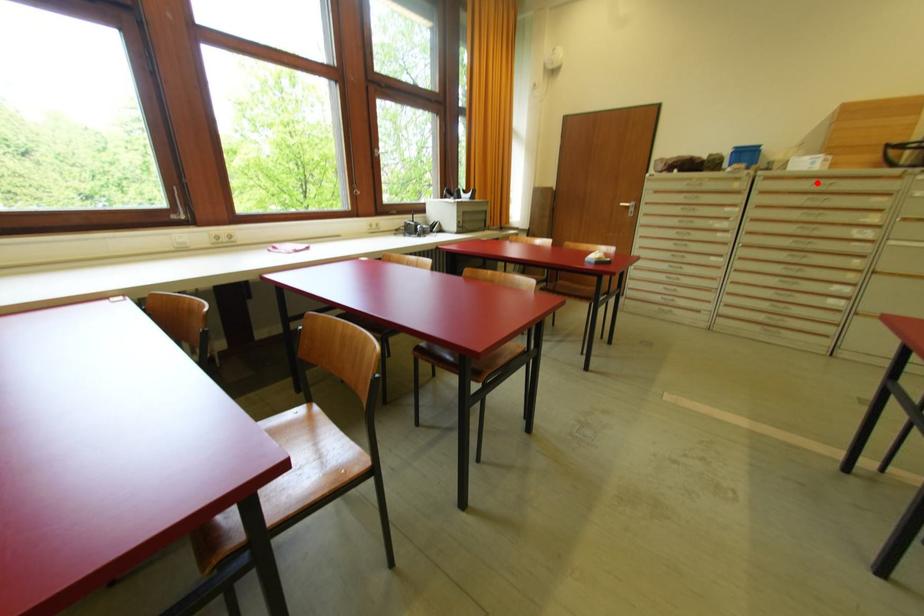
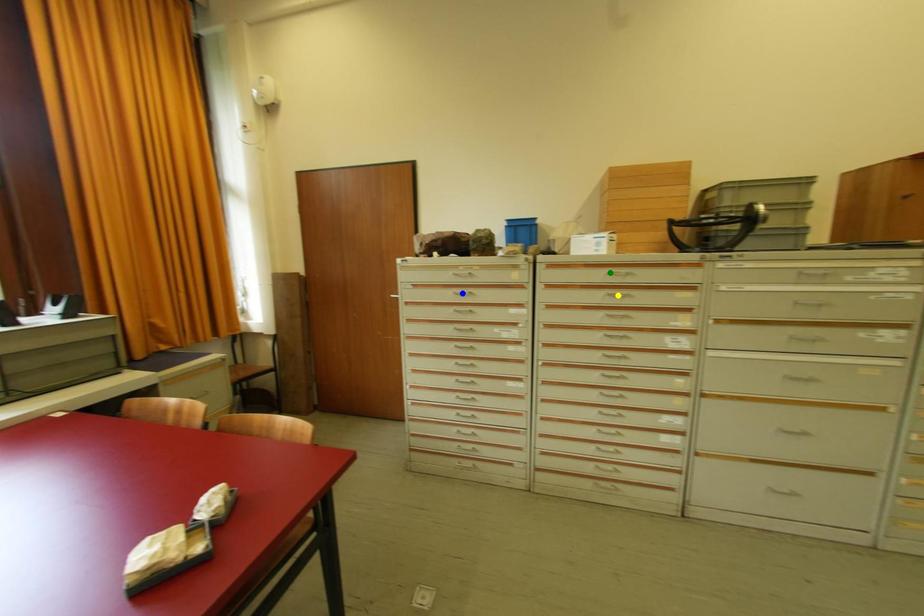
Question: I am providing you with two images of the same scene from different viewpoints. A red point is marked on the first image. You are given multiple points on the second image. Which point in image 2 is actually the same real-world point as the red point in image 1?

Choices:
 (A) green point
 (B) yellow point
 (C) blue point

Answer: (A)